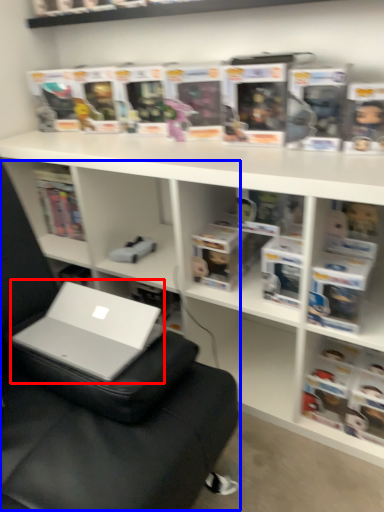
Question: Which object appears closest to the camera in this image, laptop (highlighted by a red box) or bean bag chair (highlighted by a blue box)?

Choices:
 (A) laptop
 (B) bean bag chair

Answer: (B)